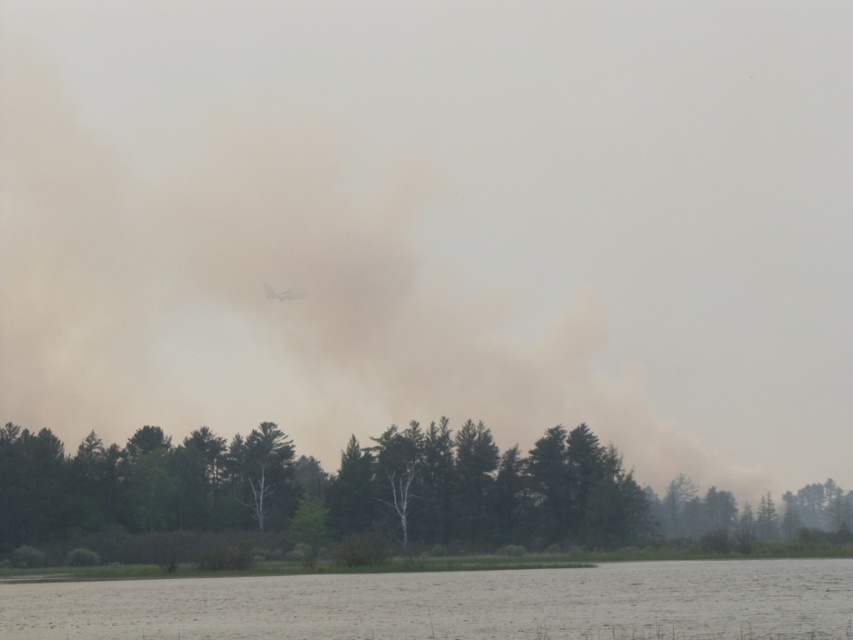
Consider the image. You are a firefighter trying to reach the water source at the gray matte water at lower center to extinguish the fire. The green matte tree at center is blocking your path. Can you walk around the tree to reach the water? Explain your reasoning based on the distance between them.

The green matte tree at center is 35.25 meters away from the gray matte water at lower center. Since the tree is only blocking part of the path, you can walk around it to reach the water as the distance allows enough space to maneuver around the tree.

You are a firefighter trying to navigate through the forest to reach the fire. You see a green matte tree at center. Based on its position coordinates, can you estimate how far it is from the center of the image?

The green matte tree at center is located at coordinates point [374,493], which means it is slightly to the right and below the exact center of the image. However, without knowing the scale or distance units, it is impossible to provide an exact distance in meters or feet. The coordinates only indicate relative position within the image frame.

You are a firefighter assessing the scene. You see the green matte tree at center and the gray matte water at lower center. Which object takes up more space in the image?

The green matte tree at center is larger in size than the gray matte water at lower center, so it takes up more space in the image.